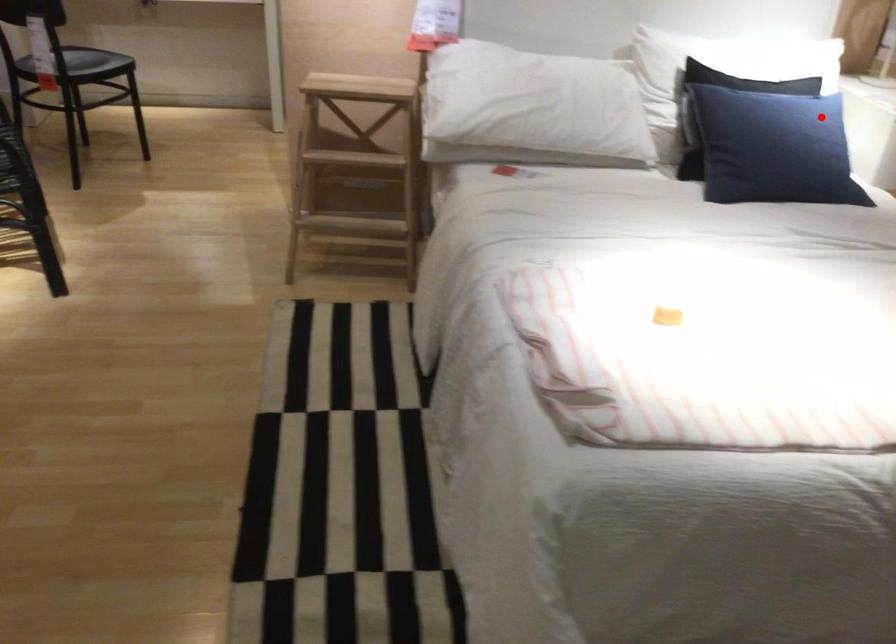
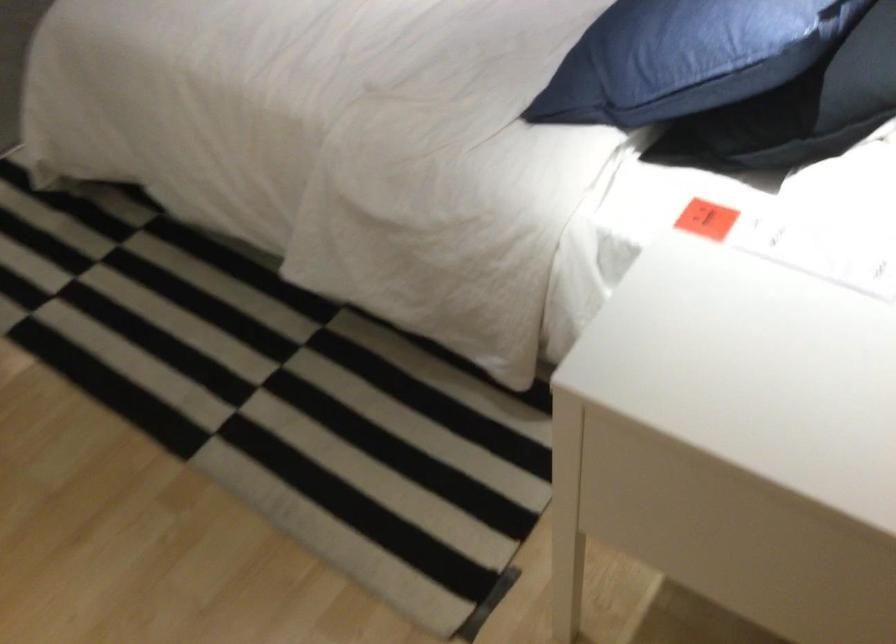
Question: I am providing you with two images of the same scene from different viewpoints. Given a red point in image1, look at the same physical point in image2. Is it:

Choices:
 (A) Closer to the viewpoint
 (B) Farther from the viewpoint

Answer: (A)